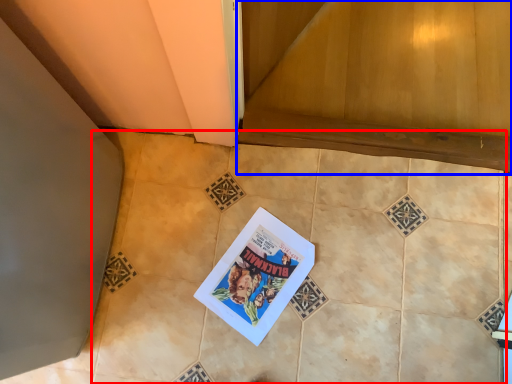
Question: Which point is closer to the camera, ceramic tile (highlighted by a red box) or stairwell (highlighted by a blue box)?

Choices:
 (A) ceramic tile
 (B) stairwell

Answer: (A)